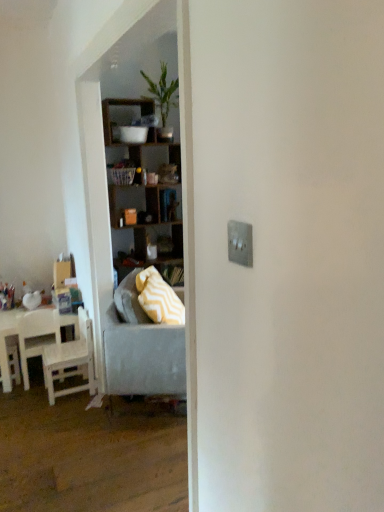
Question: Is matte cardboard box at left closer to the viewer compared to white wood table at left?

Choices:
 (A) no
 (B) yes

Answer: (A)

Question: Is matte cardboard box at left positioned far away from white wood table at left?

Choices:
 (A) no
 (B) yes

Answer: (A)

Question: Does matte cardboard box at left touch white wood table at left?

Choices:
 (A) yes
 (B) no

Answer: (B)

Question: Can you confirm if matte cardboard box at left is thinner than white wood table at left?

Choices:
 (A) yes
 (B) no

Answer: (A)

Question: From a real-world perspective, is matte cardboard box at left below white wood table at left?

Choices:
 (A) yes
 (B) no

Answer: (B)

Question: In terms of size, does white matte chair at left, which ranks as the first chair in left-to-right order, appear bigger or smaller than yellow zigzag fabric pillow at center?

Choices:
 (A) big
 (B) small

Answer: (B)

Question: From their relative heights in the image, would you say white matte chair at left, acting as the second chair starting from the right, is taller or shorter than yellow zigzag fabric pillow at center?

Choices:
 (A) tall
 (B) short

Answer: (A)

Question: In the image, is white matte chair at left, acting as the second chair starting from the right, positioned in front of or behind yellow zigzag fabric pillow at center?

Choices:
 (A) front
 (B) behind

Answer: (B)

Question: In the image, is white matte chair at left, acting as the second chair starting from the right, on the left side or the right side of yellow zigzag fabric pillow at center?

Choices:
 (A) right
 (B) left

Answer: (B)

Question: Which is correct: matte cardboard box at left is inside yellow zigzag fabric pillow at center, or outside of it?

Choices:
 (A) outside
 (B) inside

Answer: (A)

Question: Is matte cardboard box at left taller or shorter than yellow zigzag fabric pillow at center?

Choices:
 (A) short
 (B) tall

Answer: (A)

Question: Considering the positions of point click(57, 263) and point click(150, 280), is point click(57, 263) closer or farther from the camera than point click(150, 280)?

Choices:
 (A) closer
 (B) farther

Answer: (B)

Question: Is matte cardboard box at left bigger or smaller than yellow zigzag fabric pillow at center?

Choices:
 (A) small
 (B) big

Answer: (A)

Question: Considering the positions of yellow zigzag fabric pillow at center and plastic picnic basket at center in the image, is yellow zigzag fabric pillow at center wider or thinner than plastic picnic basket at center?

Choices:
 (A) thin
 (B) wide

Answer: (B)

Question: In terms of height, does yellow zigzag fabric pillow at center look taller or shorter compared to plastic picnic basket at center?

Choices:
 (A) short
 (B) tall

Answer: (B)